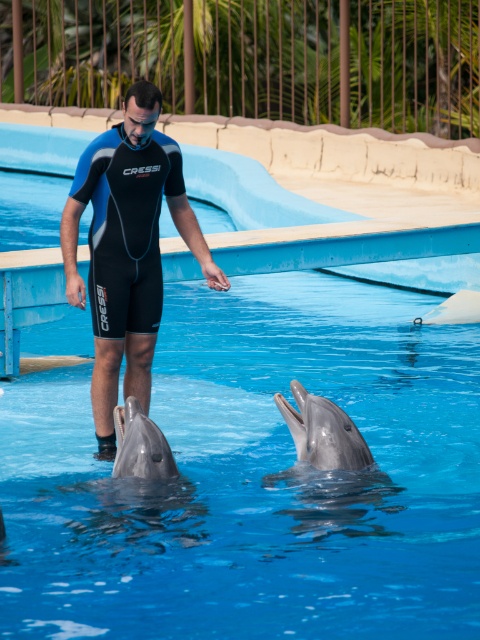
You are a marine biologist observing the scene. You need to determine which object is larger between the black neoprene wetsuit at center and the gray matte dolphin at lower center. Based on the spatial information provided, which one is larger?

The black neoprene wetsuit at center is bigger than the gray matte dolphin at lower center according to the description.

You are a dolphin trainer standing at point (124,452) and need to move to point (127,324). Which direction should you go?

Point (127,324) is behind point (124,452), so you should move backward to reach it.